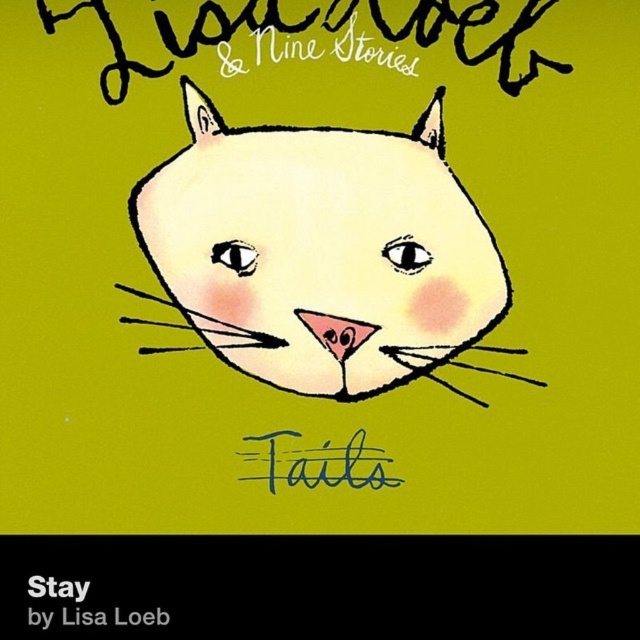
Question: Estimate the real-world distances between objects in this image. Which object is closer to the blue handwritten text at center?

Choices:
 (A) matte white cat at center
 (B) handwritten ink text at upper center

Answer: (A)

Question: Which of the following is the closest to the observer?

Choices:
 (A) click(353, 454)
 (B) click(484, 307)

Answer: (B)

Question: Does matte white cat at center have a smaller size compared to handwritten ink text at upper center?

Choices:
 (A) no
 (B) yes

Answer: (A)

Question: Does matte white cat at center lie behind handwritten ink text at upper center?

Choices:
 (A) yes
 (B) no

Answer: (A)

Question: Which object appears farthest from the camera in this image?

Choices:
 (A) handwritten ink text at upper center
 (B) matte white cat at center
 (C) blue handwritten text at center

Answer: (C)

Question: Is matte white cat at center thinner than blue handwritten text at center?

Choices:
 (A) yes
 (B) no

Answer: (B)